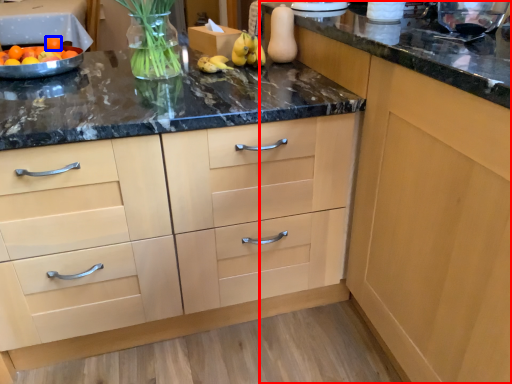
Question: Which object appears farthest to the camera in this image, cabinetry (highlighted by a red box) or tangerine (highlighted by a blue box)?

Choices:
 (A) cabinetry
 (B) tangerine

Answer: (B)